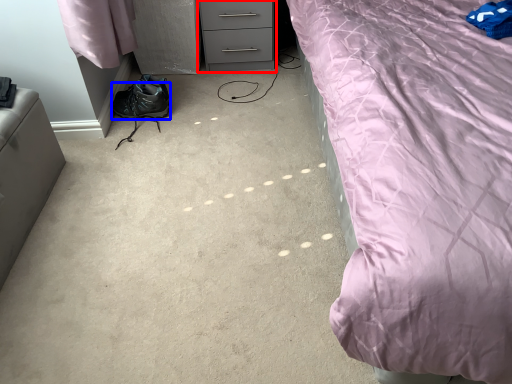
Question: Which of the following is the closest to the observer, chest of drawers (highlighted by a red box) or shoe (highlighted by a blue box)?

Choices:
 (A) chest of drawers
 (B) shoe

Answer: (B)